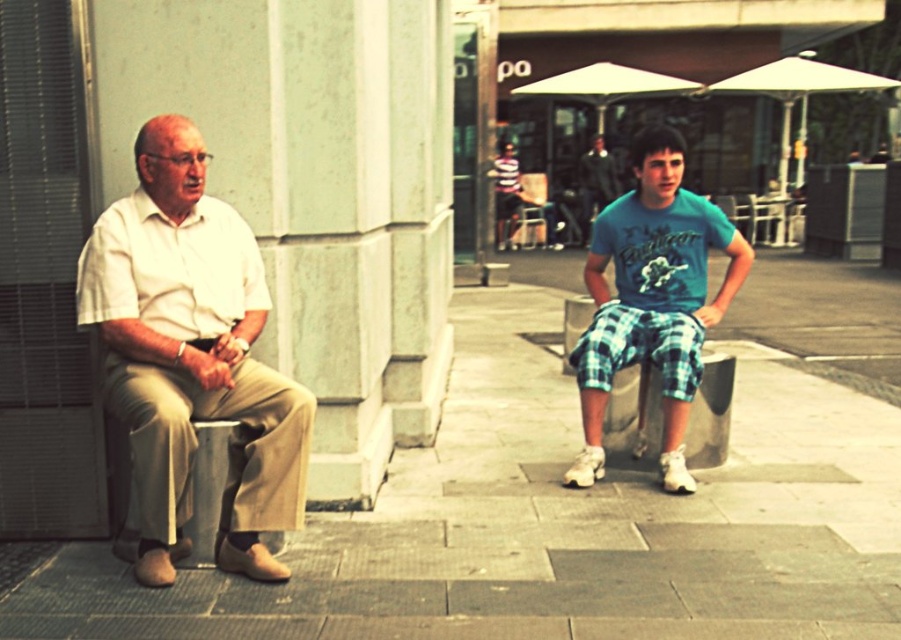
Question: Which object is farther from the camera taking this photo?

Choices:
 (A) green plaid shorts at center
 (B) white cotton shirt at left

Answer: (A)

Question: Based on their relative distances, which object is farther from the green plaid shorts at center?

Choices:
 (A) white cotton shirt at left
 (B) smooth concrete pavement at center

Answer: (A)

Question: Which object appears farthest from the camera in this image?

Choices:
 (A) white cotton shirt at left
 (B) green plaid shorts at center
 (C) smooth concrete pavement at center

Answer: (B)

Question: Does smooth concrete pavement at center have a smaller size compared to white cotton shirt at left?

Choices:
 (A) yes
 (B) no

Answer: (A)

Question: Is smooth concrete pavement at center to the left of white cotton shirt at left from the viewer's perspective?

Choices:
 (A) yes
 (B) no

Answer: (B)

Question: Does smooth concrete pavement at center lie in front of green plaid shorts at center?

Choices:
 (A) yes
 (B) no

Answer: (A)